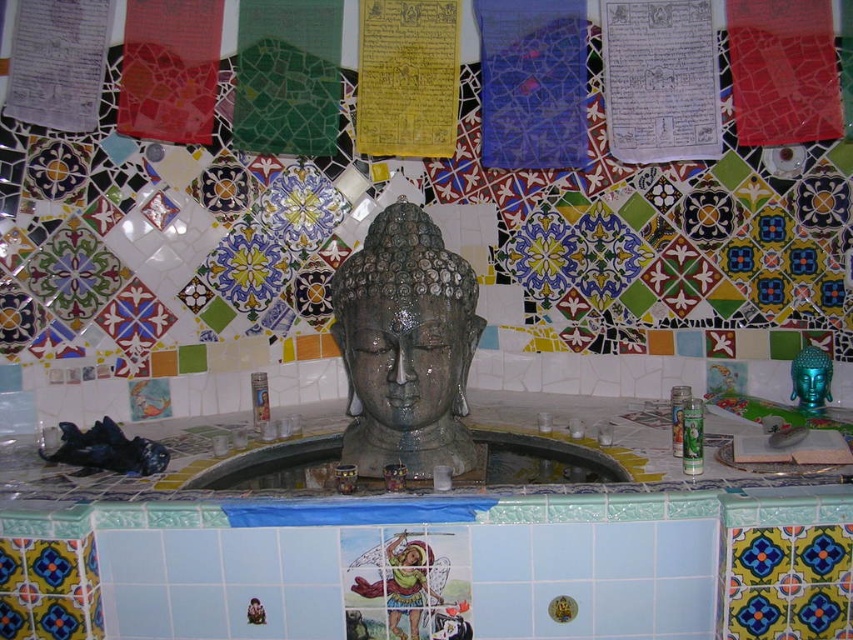
What are the coordinates of the slate stone buddha head at center?

The slate stone buddha head at center is located at coordinates point (405, 378).

You are standing in front of the altar and want to place a small offering on the slate gray stone buddha head at center. However, there is a yellow paper at upper center above it. Can you place the offering directly on the buddha head without touching the yellow paper?

The slate gray stone buddha head at center is closer to the viewer than the yellow paper at upper center, so yes, you can place the offering directly on the buddha head without touching the yellow paper as it is in front of the yellow paper.

From the picture: You are standing in front of the altar and want to place a small offering between the slate stone buddha head at center and the yellow paper at upper center. Which direction should you move the offering towards to place it between them?

The slate stone buddha head at center is positioned on the right side of yellow paper at upper center, so to place the offering between them, you should move it to the left side of the slate stone buddha head at center and the right side of the yellow paper at upper center.